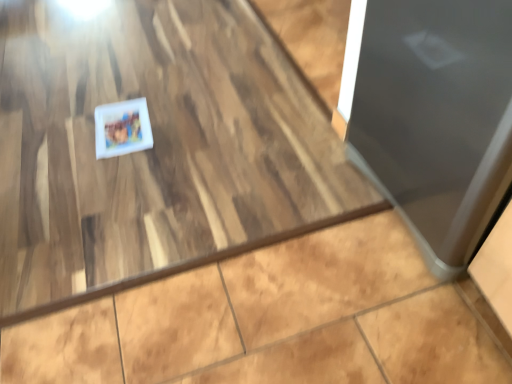
In order to click on free location in front of glossy metallic door at right in this screenshot , I will do `click(400, 324)`.